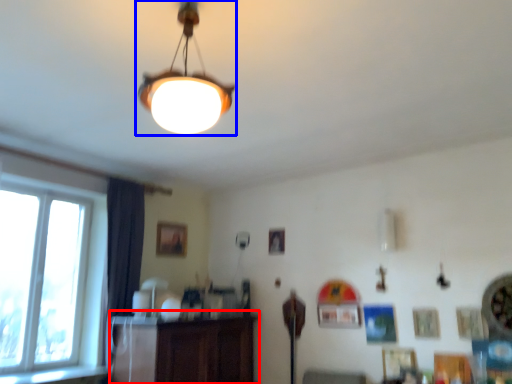
Question: Which object appears closest to the camera in this image, dresser (highlighted by a red box) or lamp (highlighted by a blue box)?

Choices:
 (A) dresser
 (B) lamp

Answer: (B)